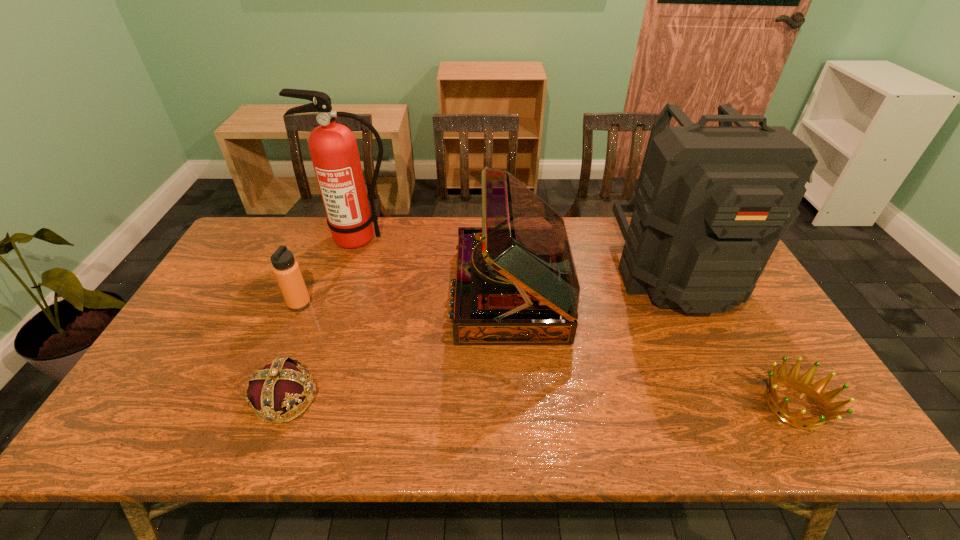
Where is `backpack that is at the right edge`? backpack that is at the right edge is located at coordinates (712, 202).

Locate an element on the screen. The height and width of the screenshot is (540, 960). crown present at the right edge is located at coordinates (815, 392).

I want to click on object that is at the far right corner, so click(712, 202).

Where is `object that is at the near right corner`? The width and height of the screenshot is (960, 540). object that is at the near right corner is located at coordinates (815, 392).

In the image, there is a desktop. Identify the location of free space at the far edge. (588, 252).

In the image, there is a desktop. At what (x,y) coordinates should I click in order to perform the action: click on free region at the left edge. Please return your answer as a coordinate pair (x, y). The image size is (960, 540). Looking at the image, I should click on (174, 379).

Image resolution: width=960 pixels, height=540 pixels. In the image, there is a desktop. What are the coordinates of `free region at the right edge` in the screenshot? It's located at (779, 327).

I want to click on blank space at the far left corner of the desktop, so click(280, 236).

Image resolution: width=960 pixels, height=540 pixels. Identify the location of free spot between the fourth shortest object and the fourth tallest object. (405, 298).

The width and height of the screenshot is (960, 540). I want to click on free space that is in between the thermos bottle and the taller crown, so click(x=293, y=351).